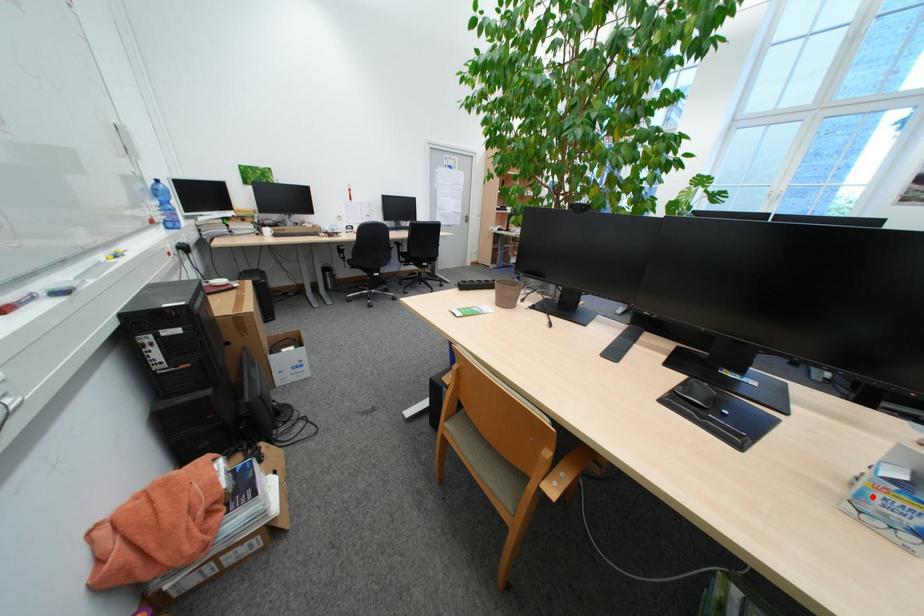
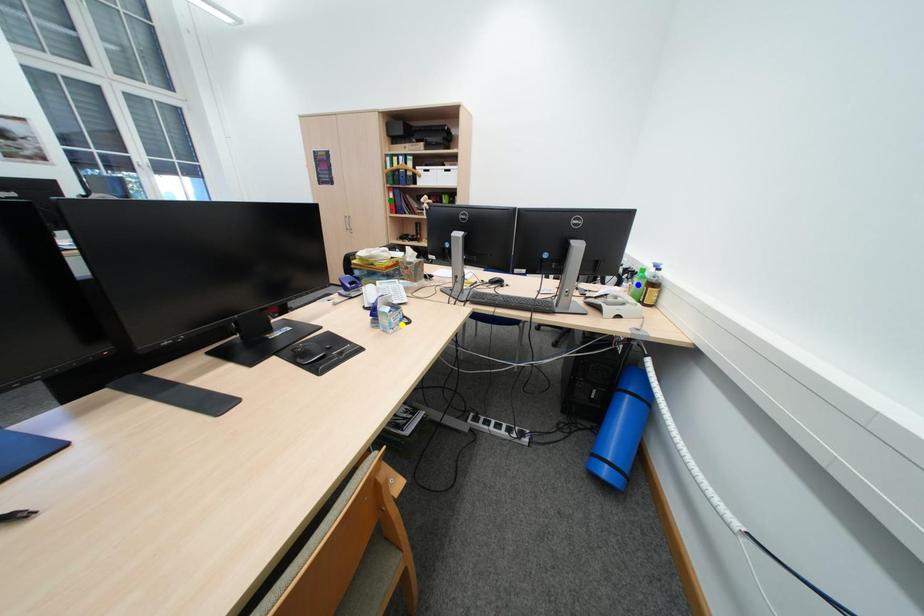
Question: I am providing you with two images of the same scene from different viewpoints. A red point is marked on the first image. You are given multiple points on the second image. Which point in image 2 is actually the same real-world point as the red point in image 1?

Choices:
 (A) blue point
 (B) yellow point
 (C) green point

Answer: (B)